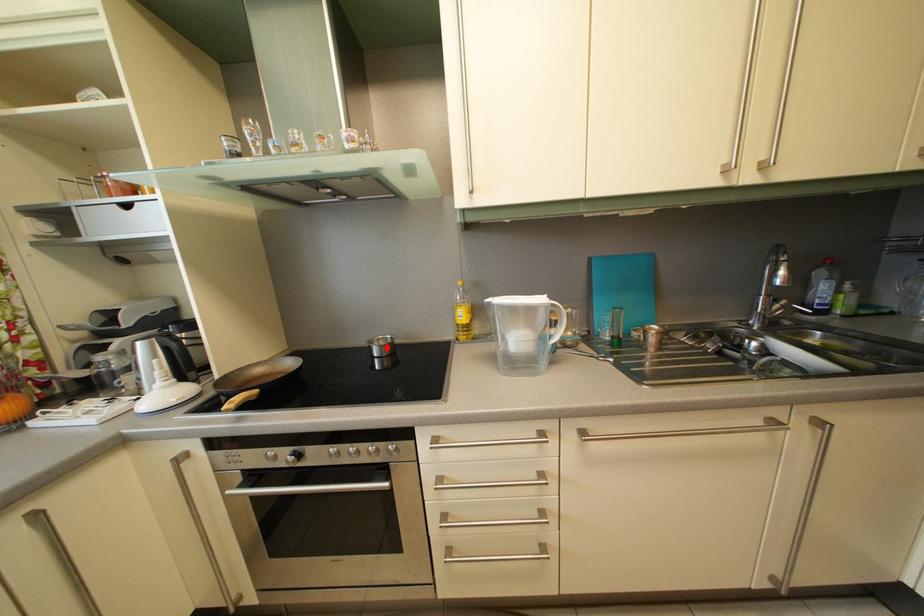
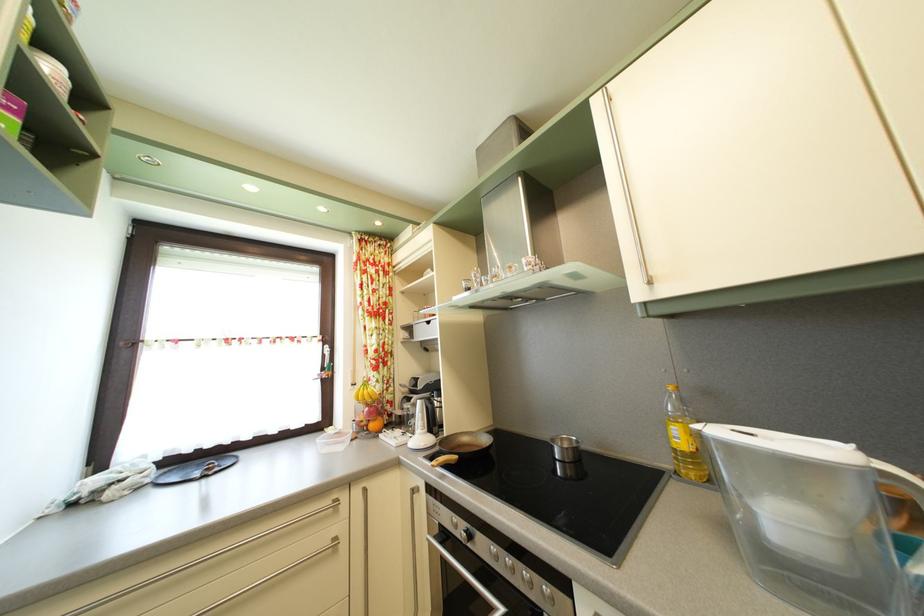
The point at the highlighted location is marked in the first image. Where is the corresponding point in the second image?

(569, 448)